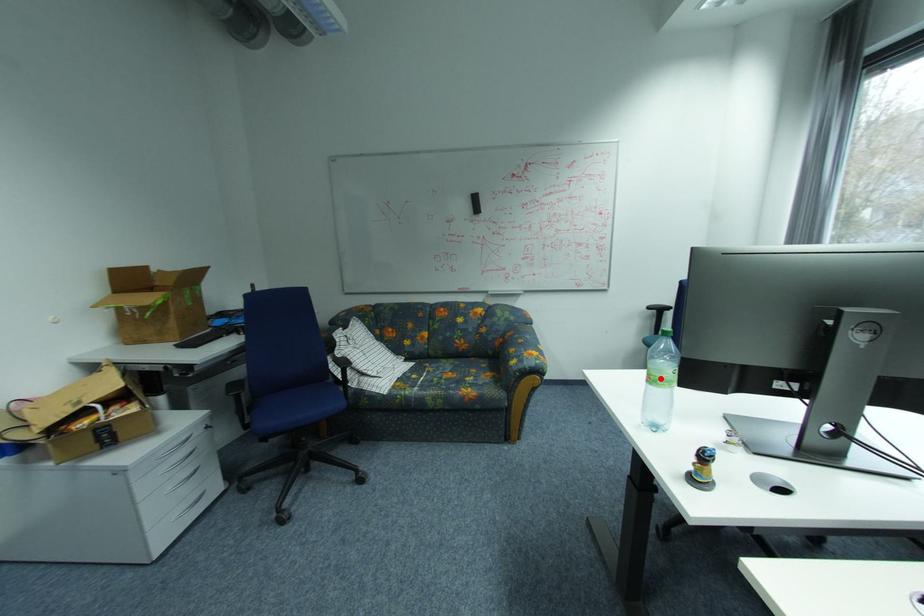
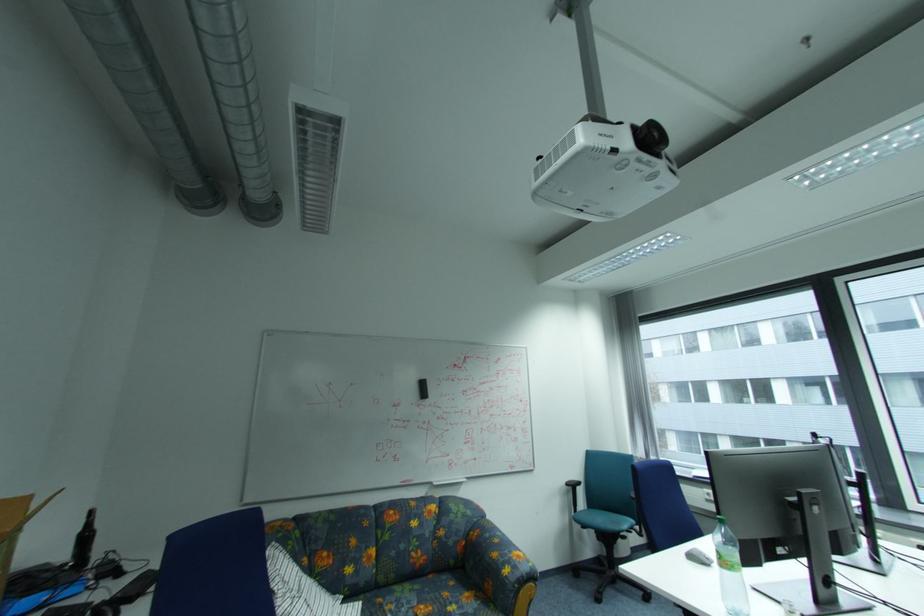
The point at the highlighted location is marked in the first image. Where is the corresponding point in the second image?

(736, 562)